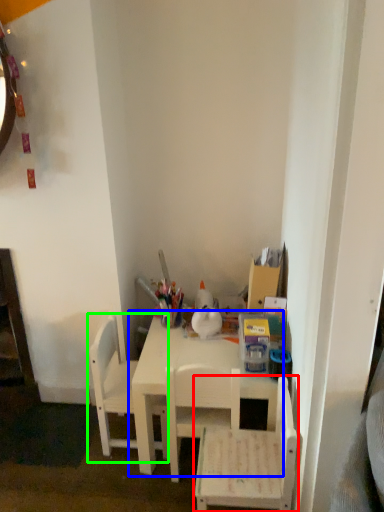
Question: Considering the real-world distances, which object is farthest from chair (highlighted by a red box)? table (highlighted by a blue box) or chair (highlighted by a green box)?

Choices:
 (A) table
 (B) chair

Answer: (B)